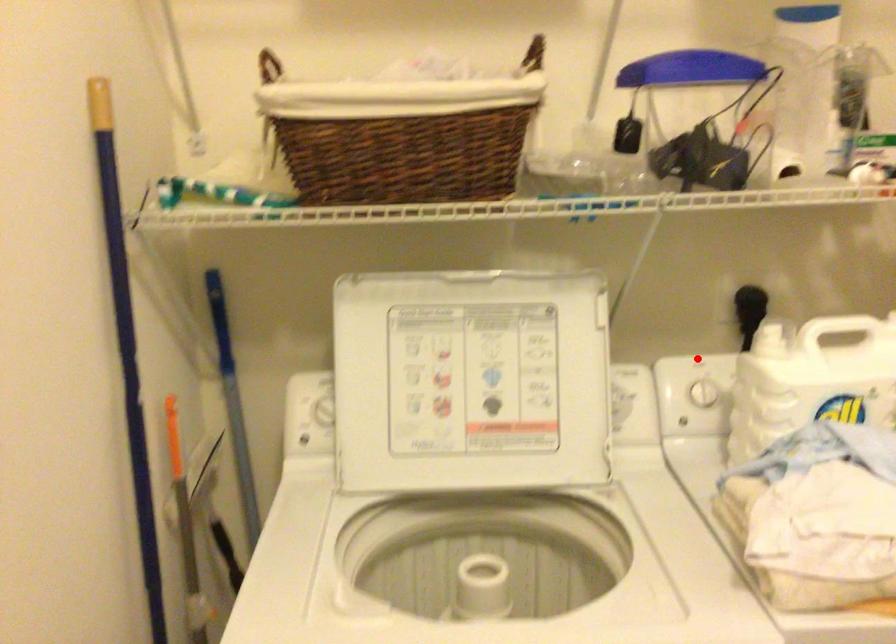
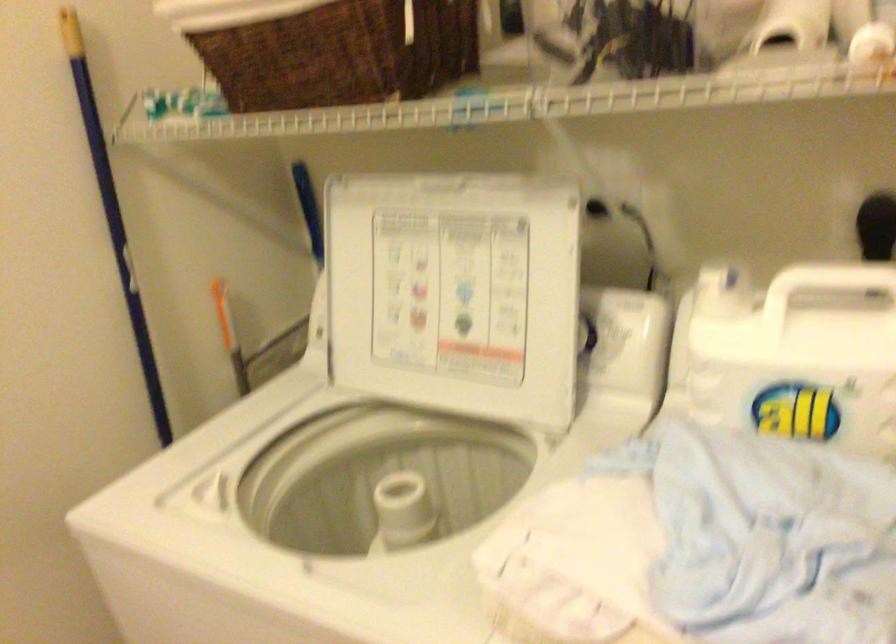
Find the pixel in the second image that matches the highlighted location in the first image.

(804, 288)